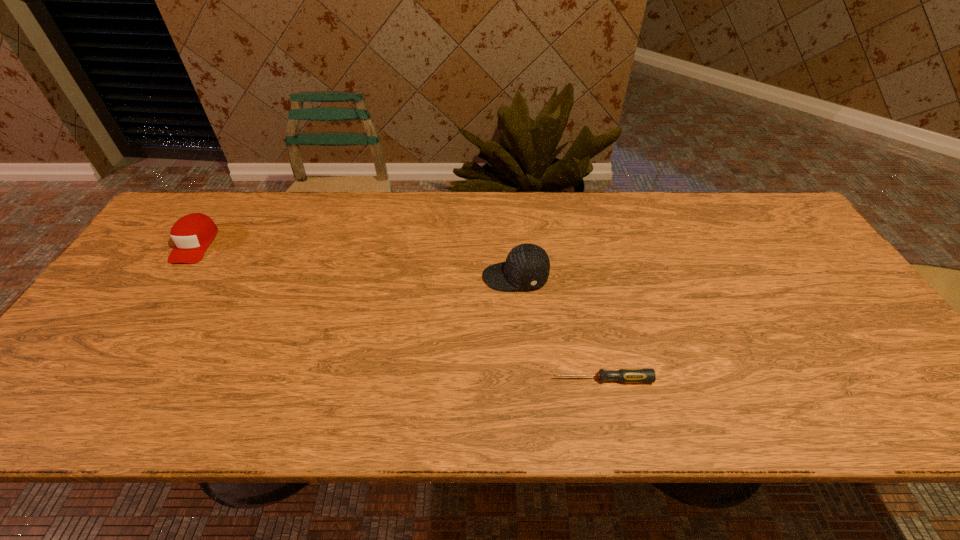
The width and height of the screenshot is (960, 540). I want to click on the taller baseball cap, so click(527, 266).

The height and width of the screenshot is (540, 960). Find the location of `the right baseball cap`. the right baseball cap is located at coordinates (527, 266).

At what (x,y) coordinates should I click in order to perform the action: click on the leftmost object. Please return your answer as a coordinate pair (x, y). This screenshot has height=540, width=960. Looking at the image, I should click on (192, 234).

Where is `the shorter baseball cap`? The image size is (960, 540). the shorter baseball cap is located at coordinates (192, 234).

Locate an element on the screen. screwdriver is located at coordinates (647, 375).

Find the location of `the shortest object`. the shortest object is located at coordinates (647, 375).

At what (x,y) coordinates should I click in order to perform the action: click on free space located 0.110m at the front of the right baseball cap where the brim is located. Please return your answer as a coordinate pair (x, y). Looking at the image, I should click on (443, 277).

You are a GUI agent. You are given a task and a screenshot of the screen. Output one action in this format:
    pyautogui.click(x=<x>, y=<y>)
    Task: Click on the free space located 0.150m at the front of the right baseball cap where the brim is located
    The image size is (960, 540).
    Given the screenshot: What is the action you would take?
    pyautogui.click(x=427, y=277)

The width and height of the screenshot is (960, 540). Identify the location of vacant space located at the front of the right baseball cap where the brim is located. (423, 277).

Locate an element on the screen. The height and width of the screenshot is (540, 960). vacant space positioned 0.220m on the front-facing side of the shorter baseball cap is located at coordinates (138, 328).